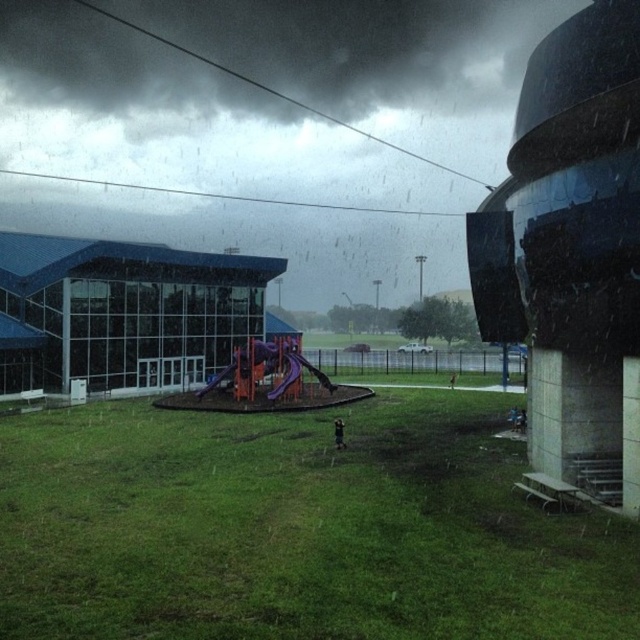
Which is above, green grassy field at center or purple matte slide at center?

Positioned higher is purple matte slide at center.

Which of these two, green grassy field at center or purple matte slide at center, stands shorter?

green grassy field at center is shorter.

Identify the location of green grassy field at center. This screenshot has height=640, width=640. (298, 529).

What are the coordinates of `green grassy field at center` in the screenshot? It's located at (298, 529).

Is the position of purple matte slide at center less distant than that of purple plastic slide at center?

No.

Which is more to the right, purple matte slide at center or purple plastic slide at center?

purple plastic slide at center is more to the right.

Who is more forward, (288, 346) or (275, 397)?

Point (275, 397)

At what (x,y) coordinates should I click in order to perform the action: click on purple matte slide at center. Please return your answer as a coordinate pair (x, y). Looking at the image, I should click on (268, 365).

Is green grassy field at center thinner than purple plastic slide at center?

In fact, green grassy field at center might be wider than purple plastic slide at center.

Measure the distance between green grassy field at center and camera.

The distance of green grassy field at center from camera is 37.95 feet.

Identify the location of green grassy field at center. (298, 529).